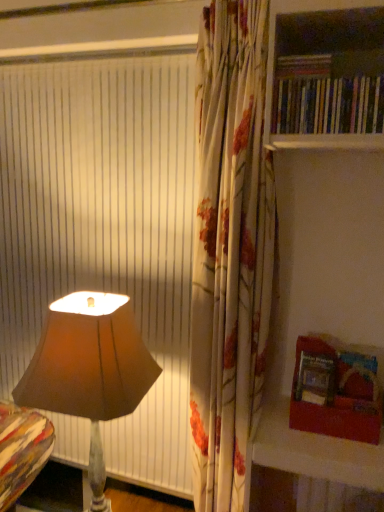
Question: Visually, is hardcover book at lower right positioned to the left or to the right of hardcover books at upper right, acting as the 2th book starting from the top?

Choices:
 (A) right
 (B) left

Answer: (B)

Question: Looking at the image, does hardcover book at lower right seem bigger or smaller compared to hardcover books at upper right, which ranks as the 1th book in bottom-to-top order?

Choices:
 (A) small
 (B) big

Answer: (A)

Question: Which of these objects is positioned farthest from the hardcover book at lower right?

Choices:
 (A) brown fabric lamp at left
 (B) wooden bookshelf at right
 (C) hardcover book at upper right, acting as the second book starting from the bottom
 (D) hardcover books at upper right, acting as the 2th book starting from the top

Answer: (C)

Question: Estimate the real-world distances between objects in this image. Which object is farther from the brown fabric lamp at left?

Choices:
 (A) wooden bookshelf at right
 (B) hardcover book at lower right
 (C) hardcover book at upper right, which ranks as the first book in top-to-bottom order
 (D) hardcover books at upper right, acting as the 2th book starting from the top

Answer: (C)